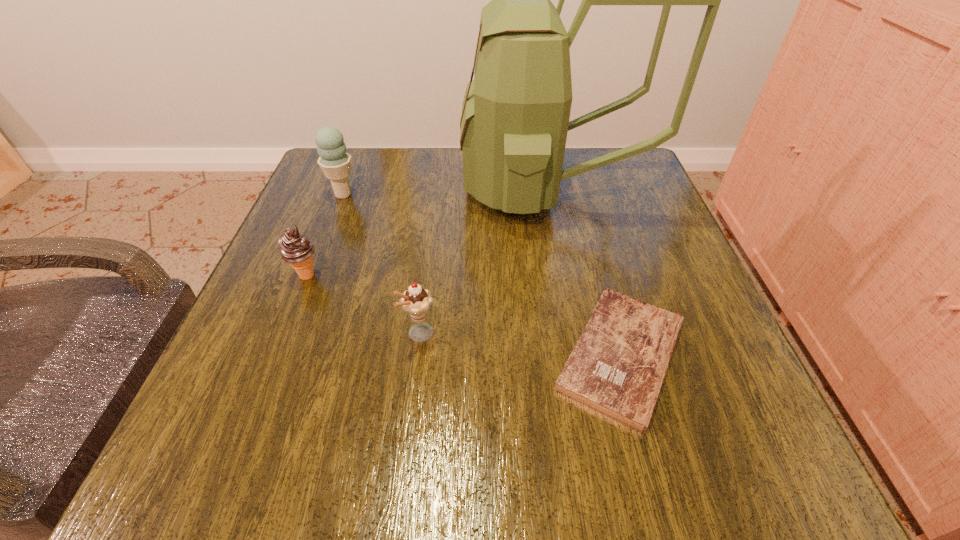
Identify which icecream is the second closest to the second tallest object. Please provide its 2D coordinates. Your answer should be formatted as a tuple, i.e. [(x, y)], where the tuple contains the x and y coordinates of a point satisfying the conditions above.

[(416, 301)]

The width and height of the screenshot is (960, 540). Identify the location of icecream that can be found as the closest to the third nearest object. (416, 301).

You are a GUI agent. You are given a task and a screenshot of the screen. Output one action in this format:
    pyautogui.click(x=<x>, y=<y>)
    Task: Click on the free space that satisfies the following two spatial constraints: 1. on the front pocket of the tallest object; 2. on the right side of the shortest object
    
    Given the screenshot: What is the action you would take?
    pyautogui.click(x=583, y=354)

Where is `free space that satisfies the following two spatial constraints: 1. on the front side of the second nearest icecream; 2. on the left side of the shortest object`? The image size is (960, 540). free space that satisfies the following two spatial constraints: 1. on the front side of the second nearest icecream; 2. on the left side of the shortest object is located at coordinates (276, 354).